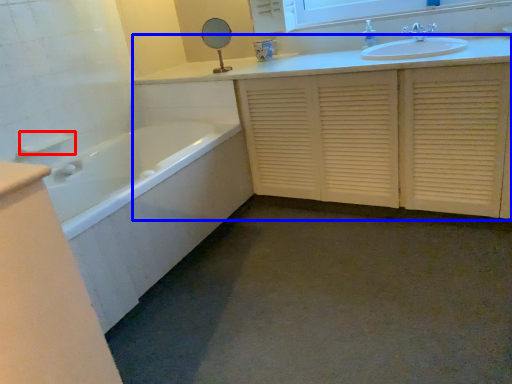
Question: Which object is further to the camera taking this photo, towel bar (highlighted by a red box) or bathroom cabinet (highlighted by a blue box)?

Choices:
 (A) towel bar
 (B) bathroom cabinet

Answer: (A)